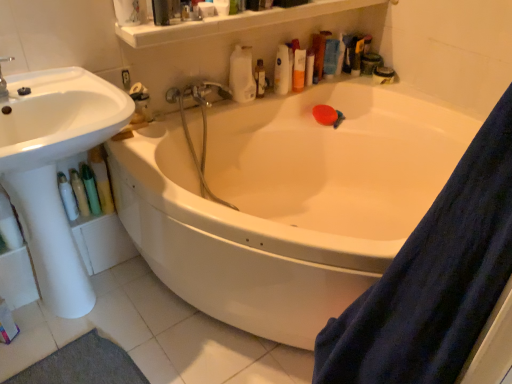
Locate an element on the screen. This screenshot has height=384, width=512. free spot below white glossy sink at left (from a real-world perspective) is located at coordinates click(83, 316).